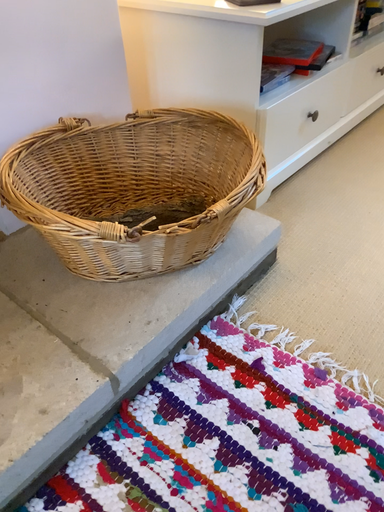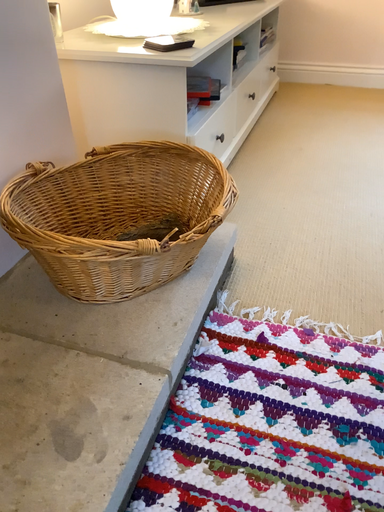
Question: How did the camera likely rotate when shooting the video?

Choices:
 (A) rotated left
 (B) rotated right

Answer: (B)